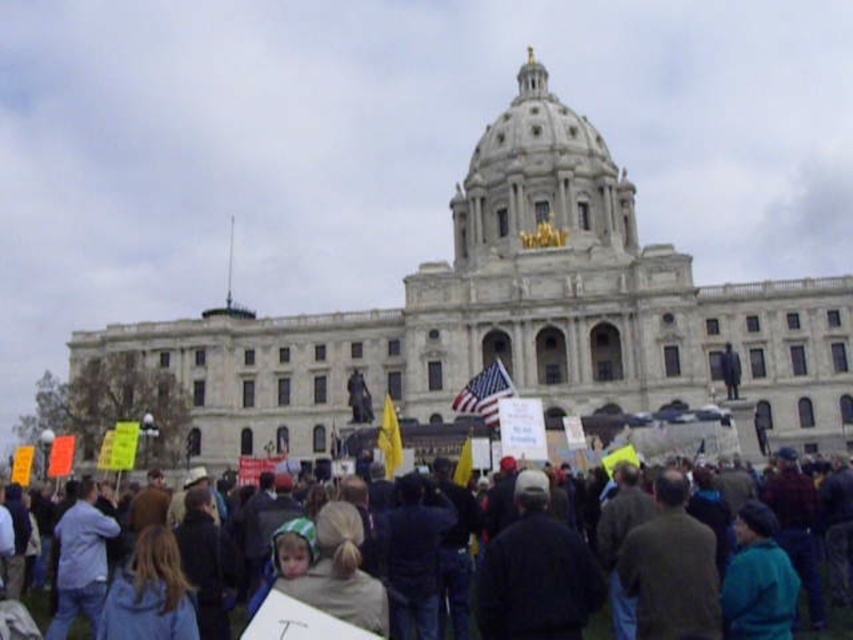
Consider the image. You are a photographer trying to capture a photo of the dark blue jackets at center and the american flag at center. Which object should you zoom in on to ensure both are clearly visible in the frame?

The dark blue jackets at center has a larger size compared to the american flag at center, so you should zoom in on the dark blue jackets at center to ensure both are clearly visible in the frame.

You are a photographer trying to capture both the american flag at center and the yellow fabric flag at center in a single frame. Based on their sizes, which flag should you focus on to ensure both fit in the photo without cropping?

The american flag at center might be wider than yellow fabric flag at center, so focusing on the american flag at center would ensure both flags fit in the photo without cropping, as it is likely the wider one.